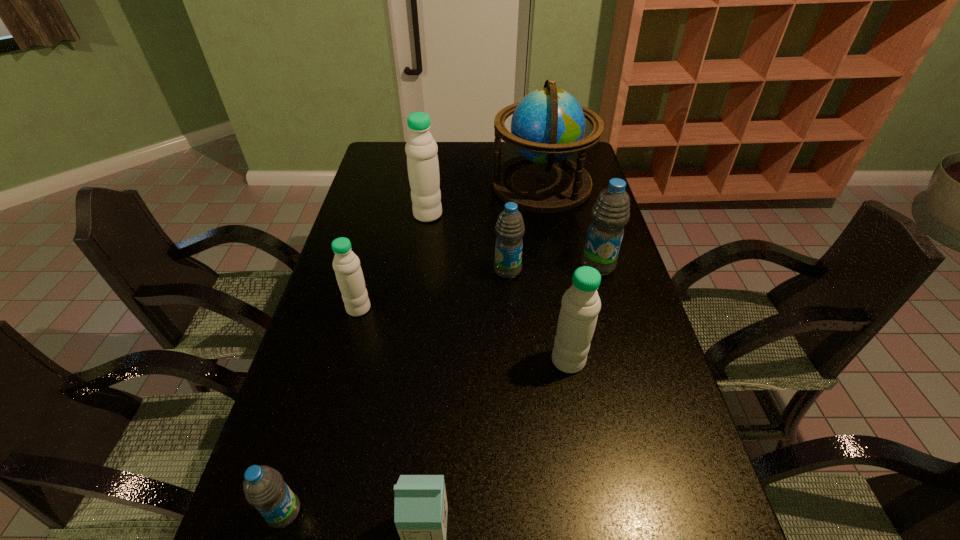
Locate which object is the fifth closest to the sixth farthest object. Please provide its 2D coordinates. Your answer should be formatted as a tuple, i.e. [(x, y)], where the tuple contains the x and y coordinates of a point satisfying the conditions above.

[(346, 264)]

Image resolution: width=960 pixels, height=540 pixels. Identify the location of the sixth closest water bottle relative to the nearest white water bottle. (421, 149).

Locate an element on the screen. This screenshot has width=960, height=540. water bottle identified as the fourth closest to the globe is located at coordinates (346, 264).

Find the location of a particular element. This screenshot has width=960, height=540. the third closest white water bottle to the second smallest white water bottle is located at coordinates (682, 539).

Where is `the fourth closest white water bottle to the globe`? the fourth closest white water bottle to the globe is located at coordinates (682, 539).

This screenshot has height=540, width=960. In order to click on blue water bottle identified as the third closest to the white milk carton in this screenshot , I will do `click(610, 213)`.

Identify which blue water bottle is located as the third nearest to the nearest white water bottle. Please provide its 2D coordinates. Your answer should be formatted as a tuple, i.e. [(x, y)], where the tuple contains the x and y coordinates of a point satisfying the conditions above.

[(509, 229)]

I want to click on free point that satisfies the following two spatial constraints: 1. on the back side of the globe; 2. on the right side of the second blue water bottle from left to right, so click(502, 184).